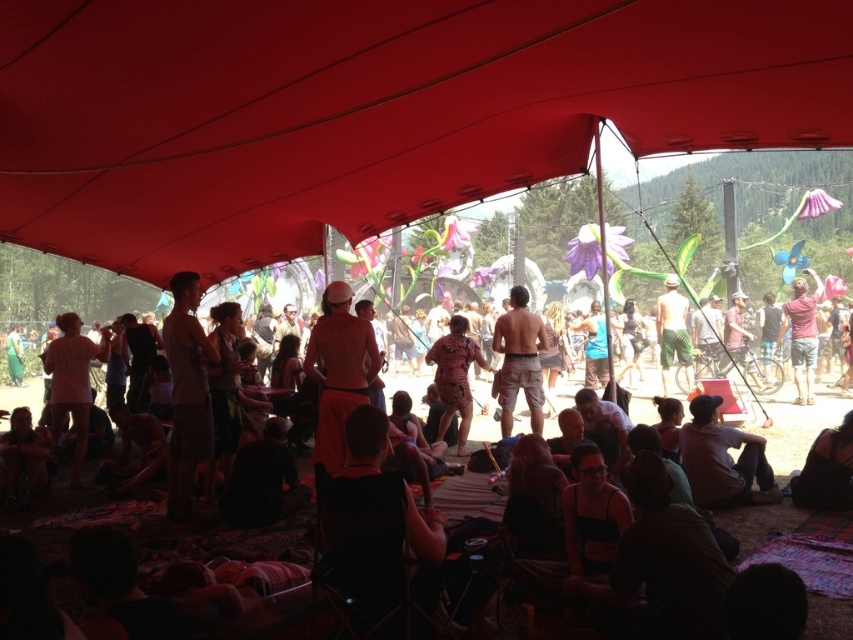
Question: Where is red fabric canopy at upper center located in relation to green textured shorts at center in the image?

Choices:
 (A) below
 (B) above

Answer: (B)

Question: Which point is farther to the camera?

Choices:
 (A) pink cotton shirt at right
 (B) red fabric canopy at upper center
 (C) green textured shorts at center
 (D) light brown fabric shorts at center

Answer: (C)

Question: Which point appears closest to the camera in this image?

Choices:
 (A) (468, 397)
 (B) (498, 502)

Answer: (B)

Question: Which point is farther from the camera taking this photo?

Choices:
 (A) (677, 340)
 (B) (508, 182)
 (C) (776, 340)

Answer: (C)

Question: Is orange fabric skirt at center smaller than tan cotton shorts at center?

Choices:
 (A) yes
 (B) no

Answer: (B)

Question: Where is orange cotton shirt at center located in relation to green textured shorts at center in the image?

Choices:
 (A) above
 (B) below

Answer: (B)